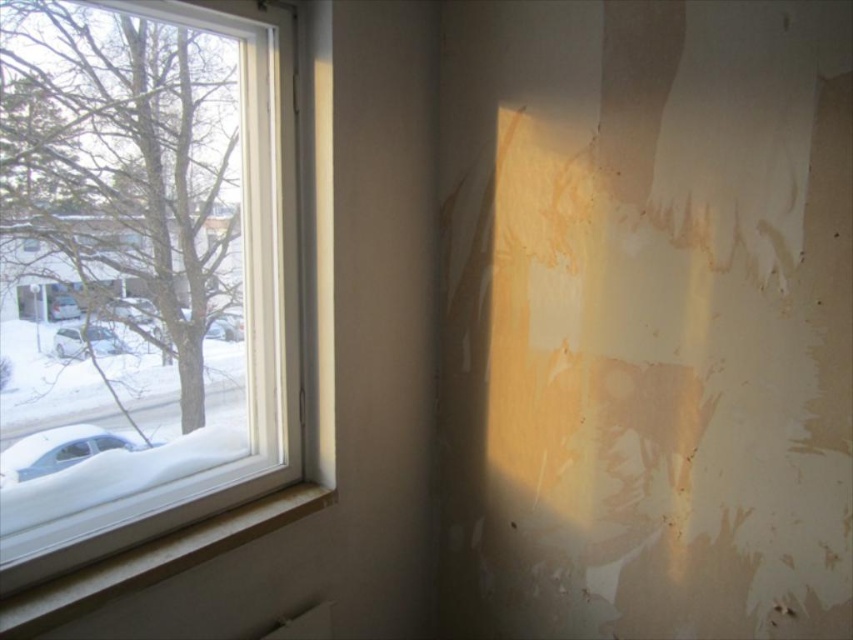
Is white wood at lower left closer to the viewer compared to white matte car at left?

Yes, it is.

Does white wood at lower left have a larger size compared to white matte car at left?

Yes.

Image resolution: width=853 pixels, height=640 pixels. In order to click on white wood at lower left in this screenshot , I will do `click(154, 561)`.

Image resolution: width=853 pixels, height=640 pixels. I want to click on white wood at lower left, so click(x=154, y=561).

Is white wood at lower left shorter than white glossy car at left?

Incorrect, white wood at lower left's height does not fall short of white glossy car at left's.

Does white wood at lower left have a greater height compared to white glossy car at left?

Indeed, white wood at lower left has a greater height compared to white glossy car at left.

Is point (247, 518) farther from camera compared to point (100, 353)?

Yes, point (247, 518) is farther from viewer.

The height and width of the screenshot is (640, 853). What are the coordinates of `white wood at lower left` in the screenshot? It's located at pos(154,561).

Which is behind, point (51, 376) or point (79, 330)?

Positioned behind is point (79, 330).

Can you confirm if white plastic window at left is bigger than white glossy car at left?

Yes, white plastic window at left is bigger than white glossy car at left.

Who is more distant from viewer, [22,356] or [107,348]?

The point [107,348] is behind.

Locate an element on the screen. This screenshot has width=853, height=640. white plastic window at left is located at coordinates click(x=144, y=272).